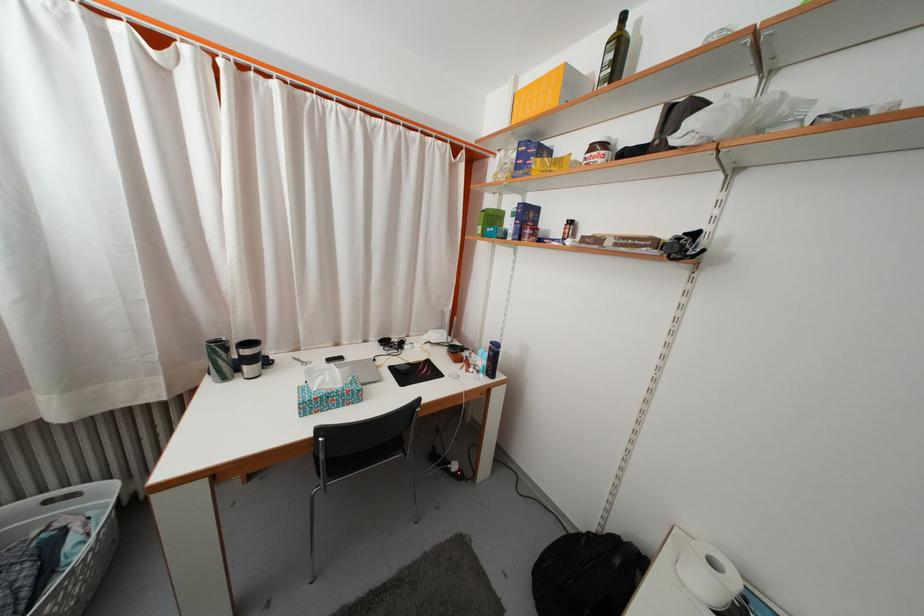
The image size is (924, 616). What are the coordinates of `green and white tumbler` in the screenshot? It's located at pyautogui.click(x=219, y=360).